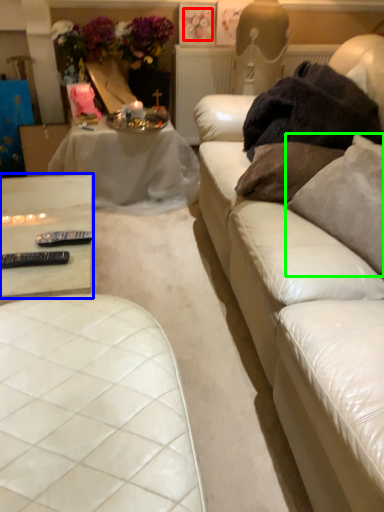
Question: Which is nearer to the flower (highlighted by a red box)? table (highlighted by a blue box) or pillow (highlighted by a green box).

Choices:
 (A) table
 (B) pillow

Answer: (A)